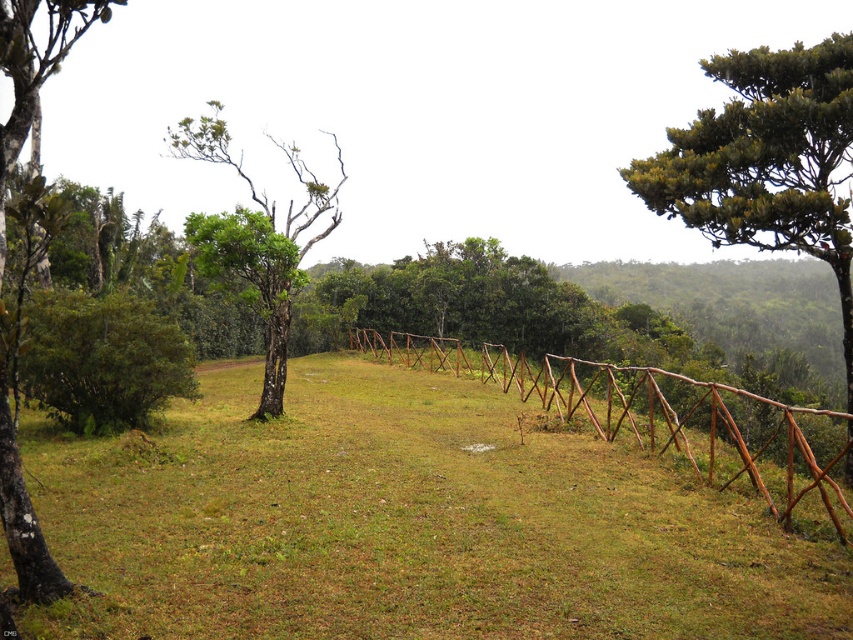
Is green leafy tree at upper right to the right of green matte tree at center from the viewer's perspective?

Yes, green leafy tree at upper right is to the right of green matte tree at center.

Is green leafy tree at upper right smaller than green matte tree at center?

Correct, green leafy tree at upper right occupies less space than green matte tree at center.

At what (x,y) coordinates should I click in order to perform the action: click on green leafy tree at upper right. Please return your answer as a coordinate pair (x, y). Looking at the image, I should click on (767, 161).

Who is taller, green grassy at center or green rough bark tree at left?

Standing taller between the two is green rough bark tree at left.

Which is above, green grassy at center or green rough bark tree at left?

green rough bark tree at left is above.

Is point (502, 481) positioned before point (56, 33)?

That is False.

In order to click on green grassy at center in this screenshot , I will do `click(405, 522)`.

Who is higher up, green matte tree at center or green rough bark tree at left?

green matte tree at center is higher up.

What do you see at coordinates (257, 240) in the screenshot? The width and height of the screenshot is (853, 640). I see `green matte tree at center` at bounding box center [257, 240].

In order to click on green matte tree at center in this screenshot , I will do `click(257, 240)`.